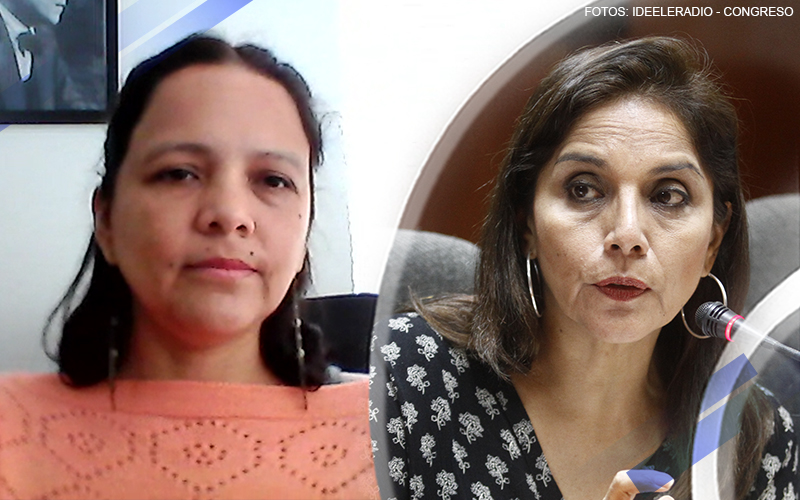
The height and width of the screenshot is (500, 800). Identify the location of light colored wall behind the woman on the left. (41, 210).